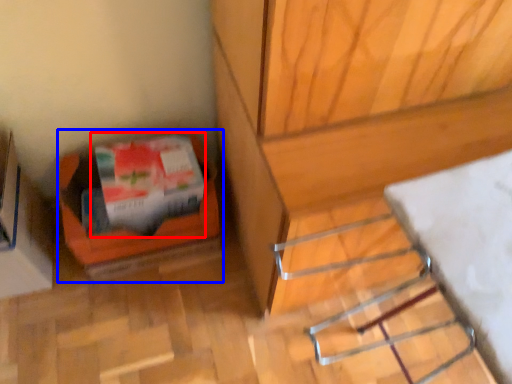
Question: Which of the following is the farthest to the observer, wrapping paper (highlighted by a red box) or box (highlighted by a blue box)?

Choices:
 (A) wrapping paper
 (B) box

Answer: (B)